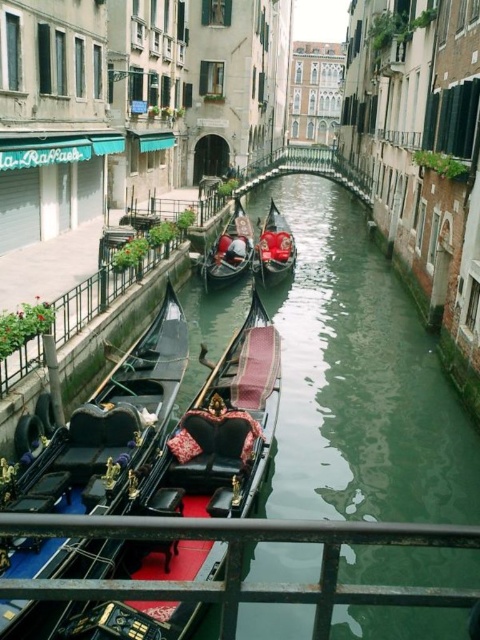
Question: Does green smooth water at center lie in front of polished wood gondola at center?

Choices:
 (A) yes
 (B) no

Answer: (B)

Question: Can you confirm if green smooth water at center is positioned to the left of shiny black gondola at center?

Choices:
 (A) no
 (B) yes

Answer: (A)

Question: Which point appears closest to the camera in this image?

Choices:
 (A) (398, 365)
 (B) (291, 260)
 (C) (156, 339)
 (D) (215, 275)

Answer: (C)

Question: Estimate the real-world distances between objects in this image. Which object is closer to the polished wood gondola at center?

Choices:
 (A) shiny black gondola at center
 (B) green smooth water at center

Answer: (B)

Question: Observing the image, what is the correct spatial positioning of shiny black gondola at center in reference to shiny red gondola at center?

Choices:
 (A) right
 (B) left

Answer: (B)

Question: Among these objects, which one is farthest from the camera?

Choices:
 (A) green smooth water at center
 (B) shiny black gondola at center

Answer: (B)